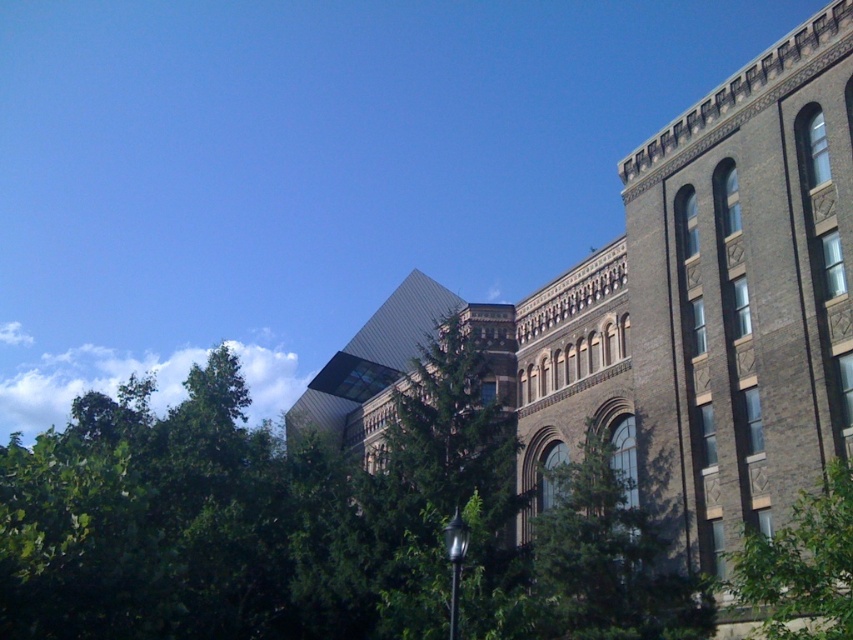
You are a photographer trying to capture the historic building in the background. You notice two green leafy trees in the foreground. Which tree, the green leafy tree at center or the green leafy tree at lower right, is closer to the camera and might block your view of the building?

The green leafy tree at center is closer to the camera than the green leafy tree at lower right, so it might block the view more.

You are standing in front of the historic building and want to walk towards the green leafy tree at lower right. Which direction should you move relative to the green leafy tree at center?

To reach the green leafy tree at lower right from the green leafy tree at center, you should move downward since the green leafy tree at center is located below the green leafy tree at lower right.